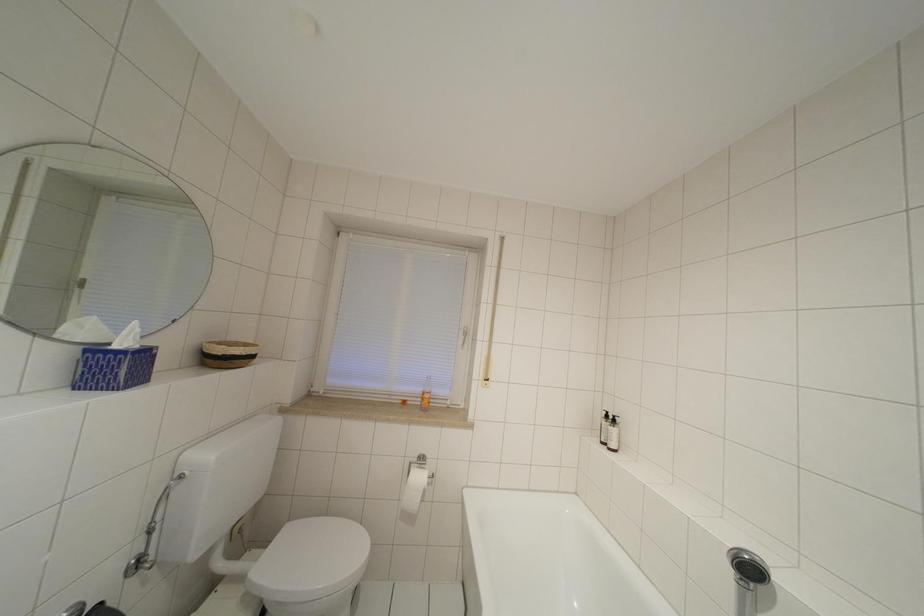
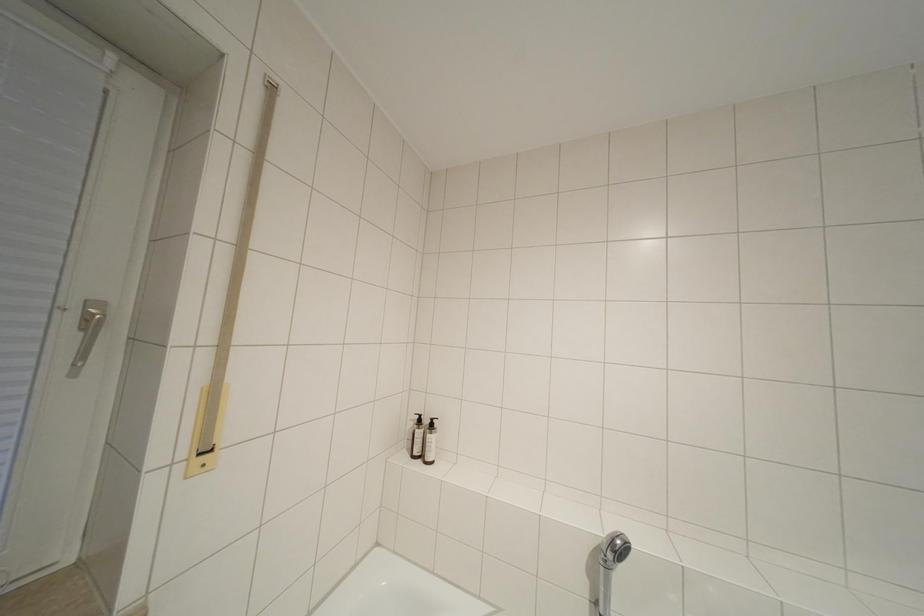
Question: The camera is either moving clockwise (left) or counter-clockwise (right) around the object. The first image is from the beginning of the video and the second image is from the end. Is the camera moving left or right when shooting the video?

Choices:
 (A) Left
 (B) Right

Answer: (A)